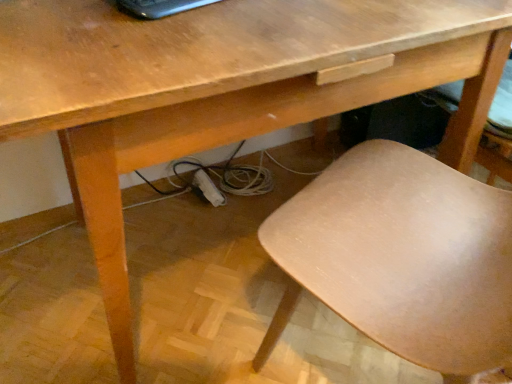
Question: From a real-world perspective, relative to light brown wood chair at lower right, is black glossy laptop at upper center vertically above or below?

Choices:
 (A) below
 (B) above

Answer: (B)

Question: Based on their positions, is black glossy laptop at upper center located to the left or right of light brown wood chair at lower right?

Choices:
 (A) left
 (B) right

Answer: (A)

Question: Relative to light brown wood chair at lower right, is black glossy laptop at upper center in front or behind?

Choices:
 (A) front
 (B) behind

Answer: (B)

Question: Does point (340, 195) appear closer or farther from the camera than point (152, 14)?

Choices:
 (A) farther
 (B) closer

Answer: (A)

Question: From the image's perspective, relative to black glossy laptop at upper center, is light brown wood chair at lower right above or below?

Choices:
 (A) above
 (B) below

Answer: (B)

Question: Is light brown wood chair at lower right to the left or to the right of black glossy laptop at upper center in the image?

Choices:
 (A) left
 (B) right

Answer: (B)

Question: From a real-world perspective, relative to black glossy laptop at upper center, is light brown wood chair at lower right vertically above or below?

Choices:
 (A) above
 (B) below

Answer: (B)